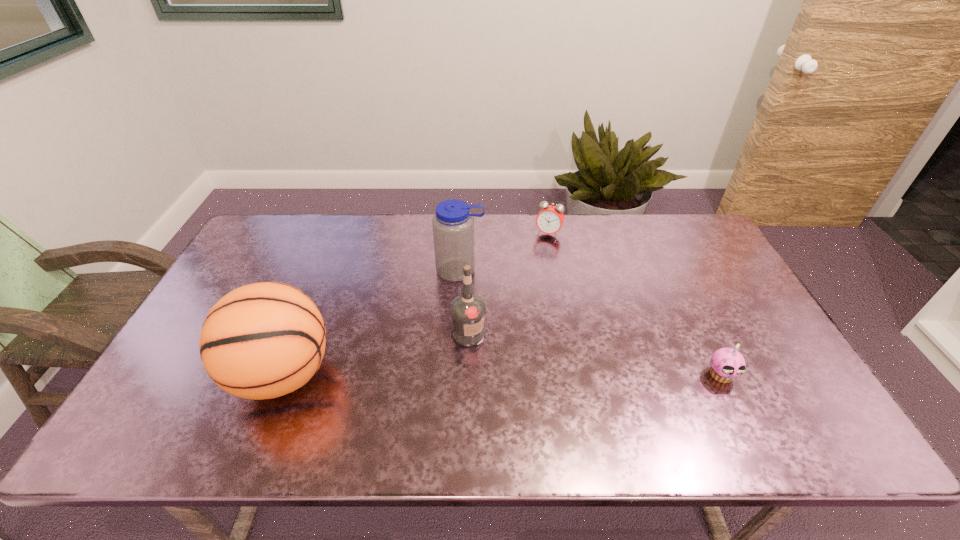
At what (x,y) coordinates should I click in order to perform the action: click on free space located 0.070m on the front label of the vodka. Please return your answer as a coordinate pair (x, y). This screenshot has height=540, width=960. Looking at the image, I should click on (504, 354).

This screenshot has height=540, width=960. Identify the location of vacant space located 0.230m on the front-facing side of the fourth object from left to right. (527, 282).

Find the location of `vacant space located on the front-facing side of the fourth object from left to right`. vacant space located on the front-facing side of the fourth object from left to right is located at coordinates (538, 255).

At what (x,y) coordinates should I click in order to perform the action: click on free spot located 0.260m on the front-facing side of the fourth object from left to right. Please return your answer as a coordinate pair (x, y). Looking at the image, I should click on pyautogui.click(x=524, y=288).

This screenshot has width=960, height=540. I want to click on free space located with a carrying loop on the side of the second farthest object, so (x=443, y=393).

This screenshot has width=960, height=540. Find the location of `free location located 0.320m with a carrying loop on the side of the second farthest object`. free location located 0.320m with a carrying loop on the side of the second farthest object is located at coordinates (446, 369).

You are a GUI agent. You are given a task and a screenshot of the screen. Output one action in this format:
    pyautogui.click(x=<x>, y=<y>)
    Task: Click on the vacant space positioned with a carrying loop on the side of the second farthest object
    
    Given the screenshot: What is the action you would take?
    pyautogui.click(x=446, y=366)

The height and width of the screenshot is (540, 960). Find the location of `object that is at the far edge`. object that is at the far edge is located at coordinates (549, 220).

Locate an element on the screen. The image size is (960, 540). basketball that is positioned at the near edge is located at coordinates (264, 340).

Where is `cupcake that is at the near edge`? cupcake that is at the near edge is located at coordinates (727, 364).